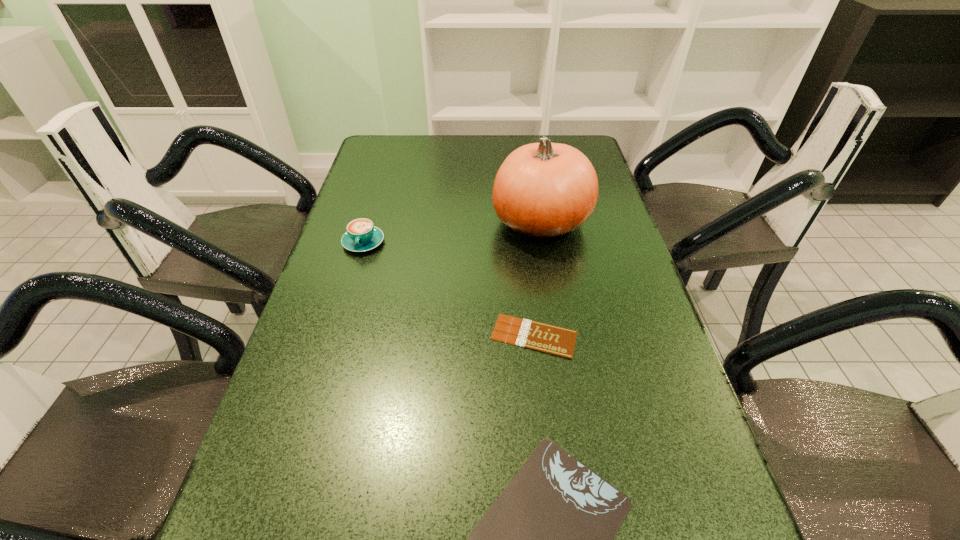
Locate an element on the screen. The width and height of the screenshot is (960, 540). pumpkin is located at coordinates (544, 190).

Where is `the leftmost object`? This screenshot has height=540, width=960. the leftmost object is located at coordinates (362, 235).

Identify the location of cappuccino. pyautogui.click(x=362, y=235).

The image size is (960, 540). I want to click on the third tallest object, so click(559, 341).

What are the coordinates of `the second nearest object` in the screenshot? It's located at (559, 341).

You are a GUI agent. You are given a task and a screenshot of the screen. Output one action in this format:
    pyautogui.click(x=<x>, y=<y>)
    Task: Click on the free space located on the front of the pumpkin
    The image size is (960, 540).
    Given the screenshot: What is the action you would take?
    pyautogui.click(x=550, y=277)

Find the location of a particular element. The height and width of the screenshot is (540, 960). vacant point located 0.170m with the handle on the right side of the second tallest object is located at coordinates (346, 303).

Identify the location of free location located on the front of the third tallest object. The image size is (960, 540). (550, 482).

In order to click on object positioned at the left edge in this screenshot , I will do `click(362, 235)`.

I want to click on object that is at the right edge, so click(544, 190).